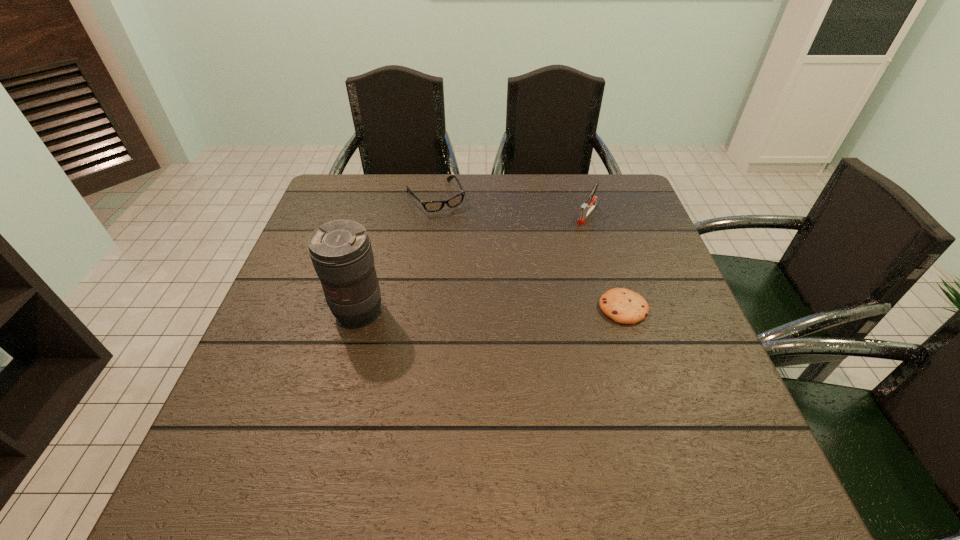
Find the location of `vacant space situated on the handle side of the third shortest object`. vacant space situated on the handle side of the third shortest object is located at coordinates (545, 268).

I want to click on vacant area located on the handle side of the third shortest object, so (x=526, y=292).

Find the location of a particular element. spectacles that is at the far edge is located at coordinates (x=430, y=206).

Where is `stapler at the far edge`? stapler at the far edge is located at coordinates (586, 208).

Where is `object that is positioned at the left edge`? object that is positioned at the left edge is located at coordinates (341, 252).

This screenshot has width=960, height=540. In order to click on cookie that is positioned at the right edge in this screenshot , I will do `click(624, 306)`.

At what (x,y) coordinates should I click in order to perform the action: click on stapler located at the right edge. Please return your answer as a coordinate pair (x, y). This screenshot has width=960, height=540. Looking at the image, I should click on (586, 208).

The height and width of the screenshot is (540, 960). What are the coordinates of `object at the far right corner` in the screenshot? It's located at (586, 208).

Where is `vacant space at the far edge of the desktop`? The width and height of the screenshot is (960, 540). vacant space at the far edge of the desktop is located at coordinates (510, 182).

In the image, there is a desktop. At what (x,y) coordinates should I click in order to perform the action: click on vacant space at the near edge. Please return your answer as a coordinate pair (x, y). The width and height of the screenshot is (960, 540). Looking at the image, I should click on (472, 438).